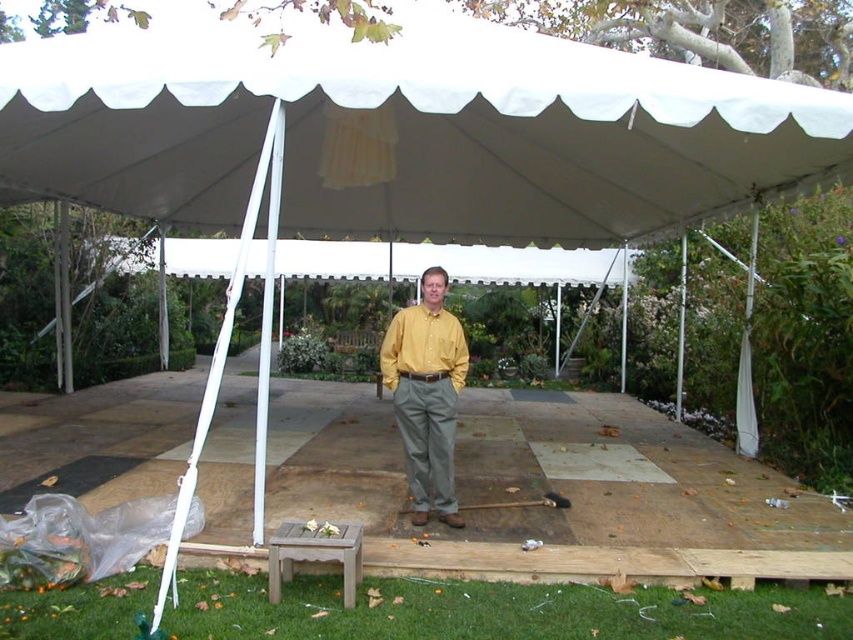
Question: Does yellow matte shirt at center appear on the left side of teak wood stool at lower center?

Choices:
 (A) yes
 (B) no

Answer: (B)

Question: Among these points, which one is nearest to the camera?

Choices:
 (A) (273, 564)
 (B) (432, 388)

Answer: (A)

Question: Can you confirm if yellow matte shirt at center is smaller than teak wood stool at lower center?

Choices:
 (A) yes
 (B) no

Answer: (B)

Question: Does yellow matte shirt at center have a larger size compared to teak wood stool at lower center?

Choices:
 (A) no
 (B) yes

Answer: (B)